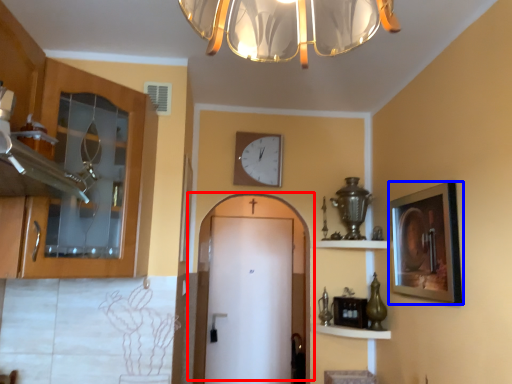
Question: Which object is closer to the camera taking this photo, door (highlighted by a red box) or picture frame (highlighted by a blue box)?

Choices:
 (A) door
 (B) picture frame

Answer: (B)